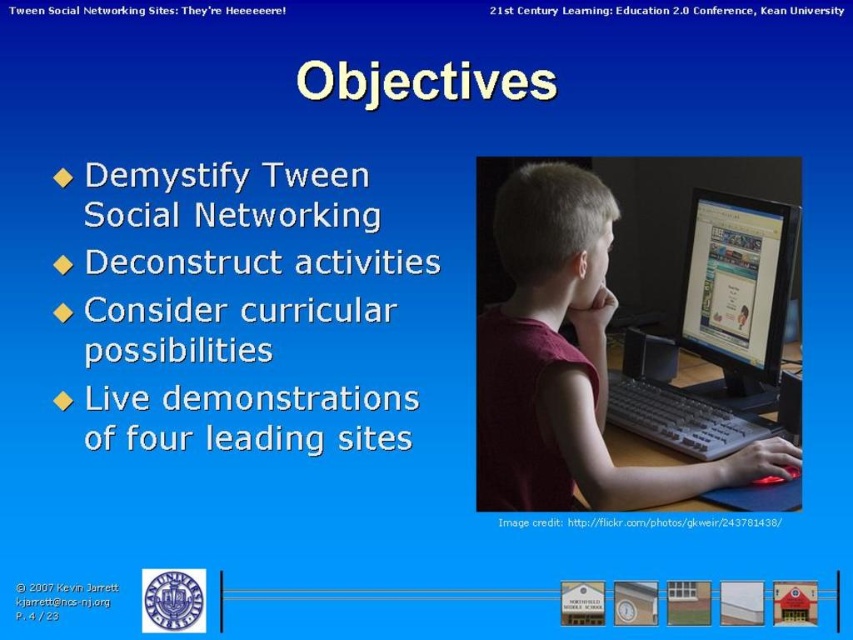
Between matte red shirt at center and matte black monitor at center, which one has more height?

Standing taller between the two is matte red shirt at center.

Between matte red shirt at center and matte black monitor at center, which one has less height?

With less height is matte black monitor at center.

Is point (601, 196) positioned behind point (755, 269)?

No.

Image resolution: width=853 pixels, height=640 pixels. Find the location of `matte red shirt at center`. matte red shirt at center is located at coordinates (567, 364).